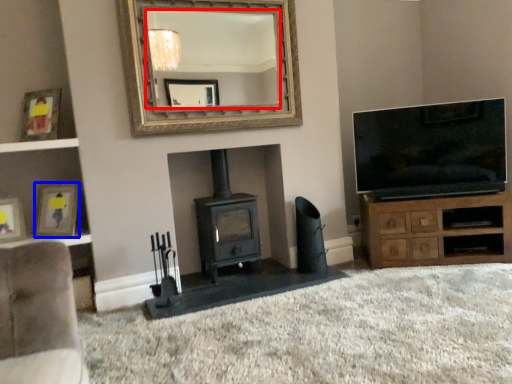
Question: Which object is closer to the camera taking this photo, mirror (highlighted by a red box) or picture frame (highlighted by a blue box)?

Choices:
 (A) mirror
 (B) picture frame

Answer: (A)